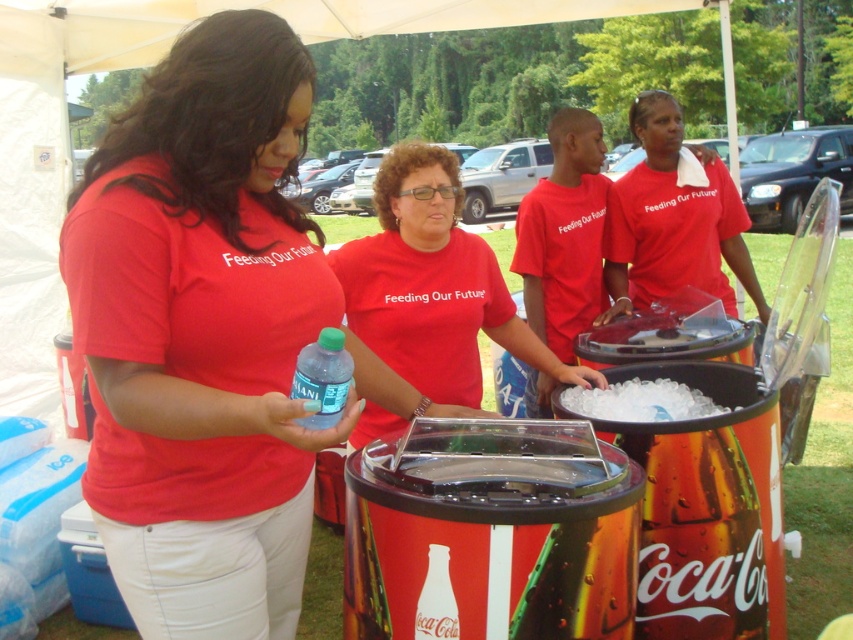
Which is above, matte red shirt at center or clear plastic bottle at center?

clear plastic bottle at center

Can you confirm if matte red shirt at center is smaller than clear plastic bottle at center?

No, matte red shirt at center is not smaller than clear plastic bottle at center.

Does point (206, 90) lie behind point (302, 353)?

Yes, it is behind point (302, 353).

At what (x,y) coordinates should I click in order to perform the action: click on matte red shirt at center. Please return your answer as a coordinate pair (x, y). The width and height of the screenshot is (853, 640). Looking at the image, I should click on (202, 333).

Consider the image. Does clear plastic ice at center appear over translucent plastic bottle at center?

Yes, clear plastic ice at center is above translucent plastic bottle at center.

Which is in front, point (624, 419) or point (434, 579)?

Point (434, 579) is more forward.

Which is in front, point (663, 388) or point (444, 636)?

Point (444, 636) is more forward.

Where is `clear plastic ice at center`? clear plastic ice at center is located at coordinates (640, 401).

Between matte red shirt at center and translucent plastic bottle at center, which one appears on the right side from the viewer's perspective?

translucent plastic bottle at center is more to the right.

Describe the element at coordinates (202, 333) in the screenshot. I see `matte red shirt at center` at that location.

Image resolution: width=853 pixels, height=640 pixels. What are the coordinates of `matte red shirt at center` in the screenshot? It's located at (202, 333).